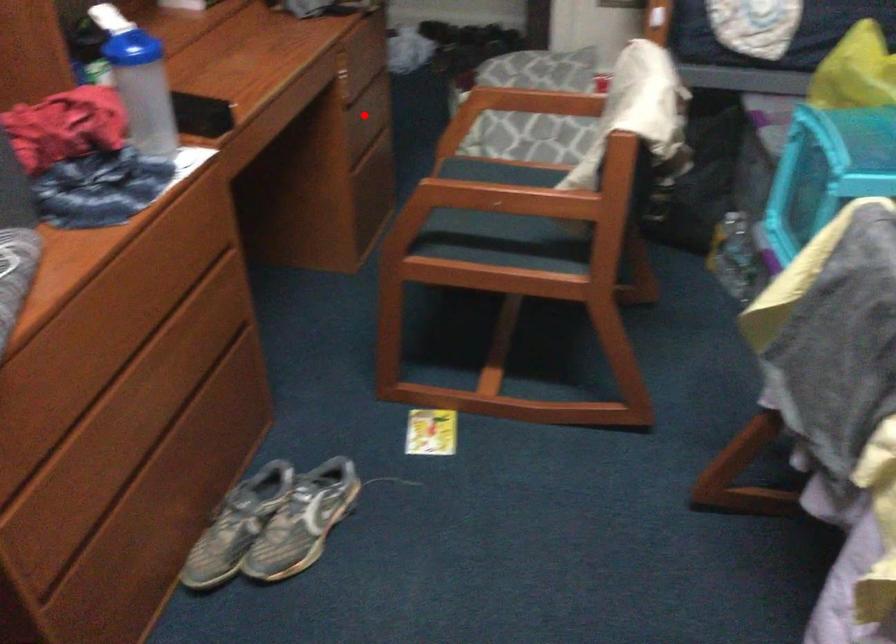
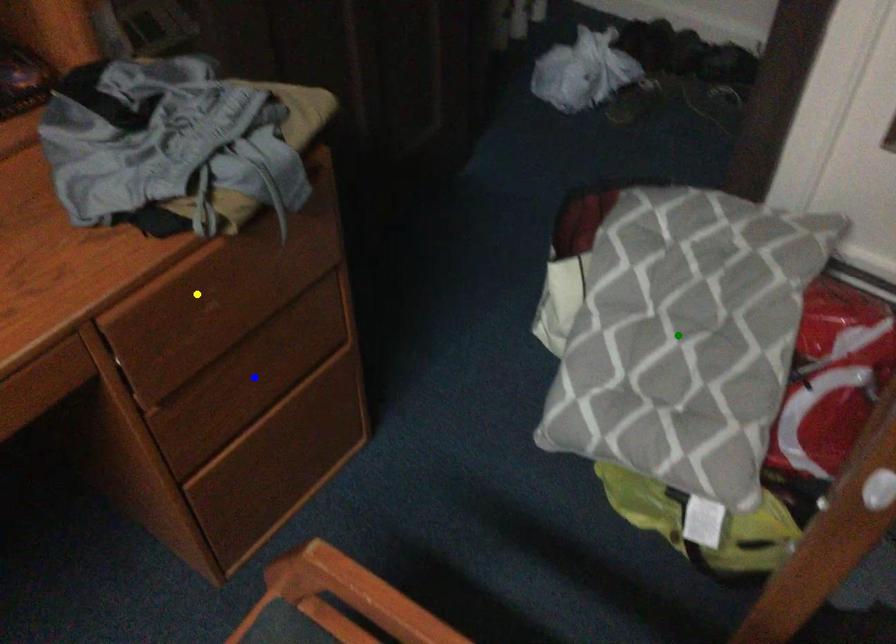
Question: I am providing you with two images of the same scene from different viewpoints. A red point is marked on the first image. You are given multiple points on the second image. In image 2, which mark is for the same physical point as the one in image 1?

Choices:
 (A) yellow point
 (B) blue point
 (C) green point

Answer: (B)